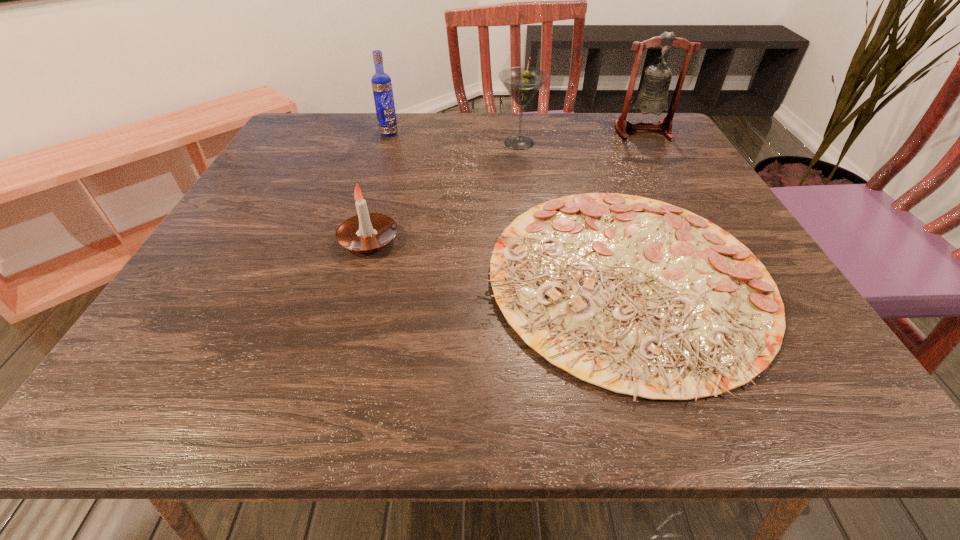
Where is `vacant area between the vodka and the bell`? The image size is (960, 540). vacant area between the vodka and the bell is located at coordinates (516, 132).

Find the location of `the fourth closest object to the pizza`. the fourth closest object to the pizza is located at coordinates (381, 82).

Identify which object is located as the nearest to the tallest object. Please provide its 2D coordinates. Your answer should be formatted as a tuple, i.e. [(x, y)], where the tuple contains the x and y coordinates of a point satisfying the conditions above.

[(522, 83)]

Find the location of `free space that satisfies the following two spatial constraints: 1. on the front side of the pizza; 2. on the right side of the martini`. free space that satisfies the following two spatial constraints: 1. on the front side of the pizza; 2. on the right side of the martini is located at coordinates (538, 279).

Locate an element on the screen. Image resolution: width=960 pixels, height=540 pixels. vacant area in the image that satisfies the following two spatial constraints: 1. on the back side of the bell; 2. on the left side of the martini is located at coordinates (517, 132).